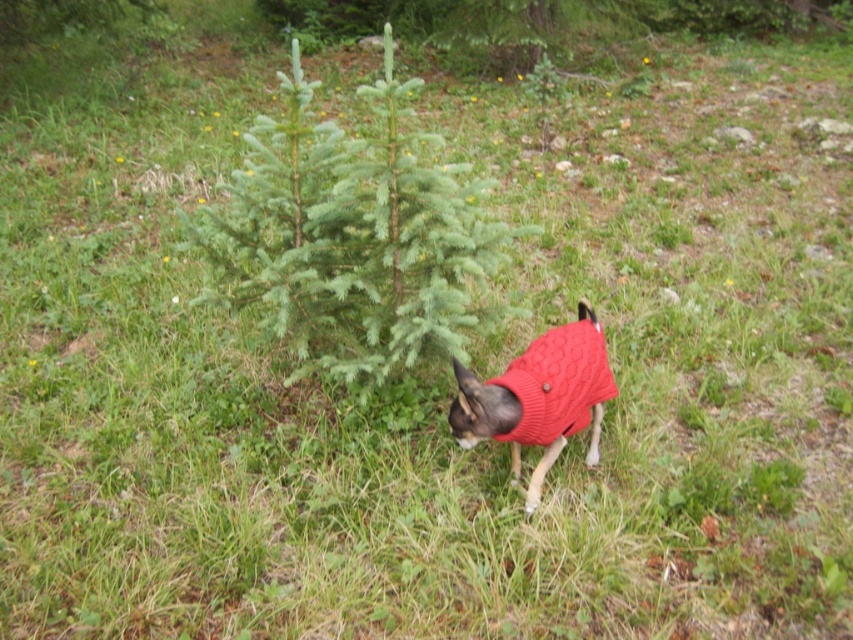
Question: Which of the following is the farthest from the observer?

Choices:
 (A) cable-knit sweater at lower right
 (B) green needle-like fir tree at center

Answer: (B)

Question: Can you confirm if green needle-like fir tree at center is positioned above cable-knit sweater at lower right?

Choices:
 (A) no
 (B) yes

Answer: (B)

Question: Is green needle-like fir tree at center below cable-knit sweater at lower right?

Choices:
 (A) no
 (B) yes

Answer: (A)

Question: Which of the following is the farthest from the observer?

Choices:
 (A) green needle-like fir tree at center
 (B) cable-knit sweater at lower right

Answer: (A)

Question: Is green needle-like fir tree at center to the right of cable-knit sweater at lower right from the viewer's perspective?

Choices:
 (A) no
 (B) yes

Answer: (A)